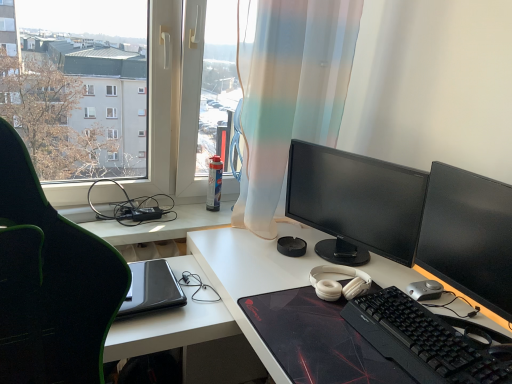
At what (x,y) coordinates should I click in order to perform the action: click on vacant space to the right of white matte headphones at center. Please return your answer as a coordinate pair (x, y). Looking at the image, I should click on (398, 279).